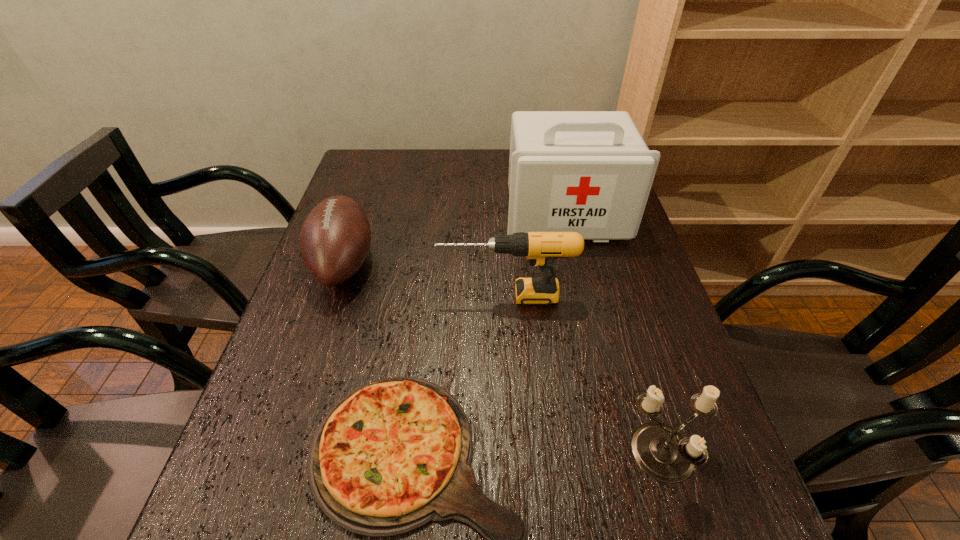
Locate an element on the screen. The width and height of the screenshot is (960, 540). free space that is in between the candle holder and the tallest object is located at coordinates (615, 335).

You are a GUI agent. You are given a task and a screenshot of the screen. Output one action in this format:
    pyautogui.click(x=<x>, y=<y>)
    Task: Click on the free spot between the candle holder and the tallest object
    Image resolution: width=960 pixels, height=540 pixels.
    Given the screenshot: What is the action you would take?
    pyautogui.click(x=615, y=335)

Where is `empty space that is in between the candle holder and the football (American)`? The height and width of the screenshot is (540, 960). empty space that is in between the candle holder and the football (American) is located at coordinates (504, 360).

The image size is (960, 540). I want to click on the fourth closest object to the first-aid kit, so click(x=665, y=454).

Point out which object is positioned as the second nearest to the football (American). Please provide its 2D coordinates. Your answer should be formatted as a tuple, i.e. [(x, y)], where the tuple contains the x and y coordinates of a point satisfying the conditions above.

[(394, 454)]

What are the coordinates of `free space that satisfies the following two spatial constraints: 1. on the handle side of the candle holder; 2. on the right side of the drill` in the screenshot? It's located at (516, 456).

Find the location of a particular element. This screenshot has width=960, height=540. vacant space that satisfies the following two spatial constraints: 1. on the handle side of the candle holder; 2. on the left side of the drill is located at coordinates (516, 456).

You are a GUI agent. You are given a task and a screenshot of the screen. Output one action in this format:
    pyautogui.click(x=<x>, y=<y>)
    Task: Click on the vacant space that satisfies the following two spatial constraints: 1. on the handle side of the drill; 2. on the back side of the candle holder
    
    Given the screenshot: What is the action you would take?
    point(516,456)

At what (x,y) coordinates should I click in order to perform the action: click on free point that satisfies the following two spatial constraints: 1. on the front-facing side of the first-aid kit; 2. on the right side of the candle holder. Please return your answer as a coordinate pair (x, y). Looking at the image, I should click on (622, 456).